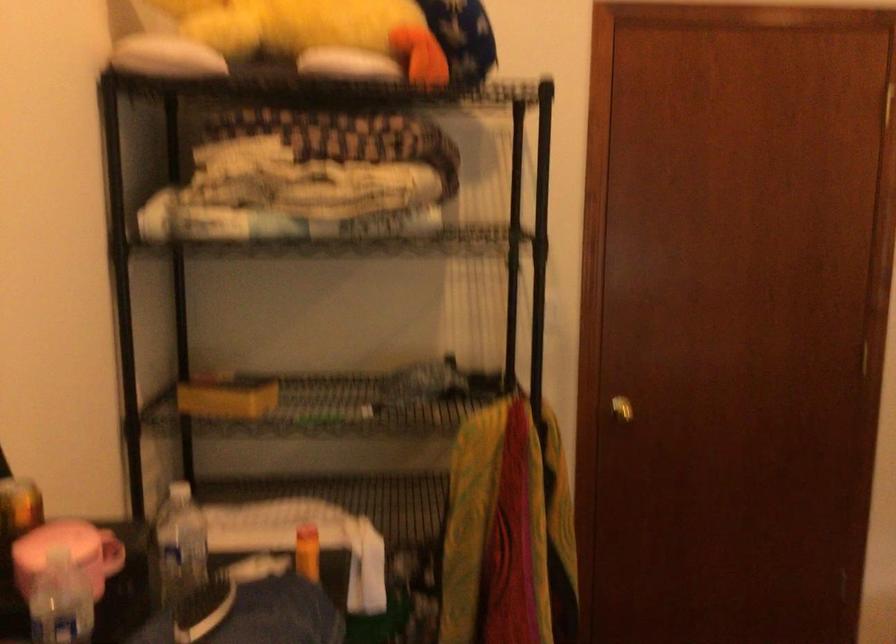
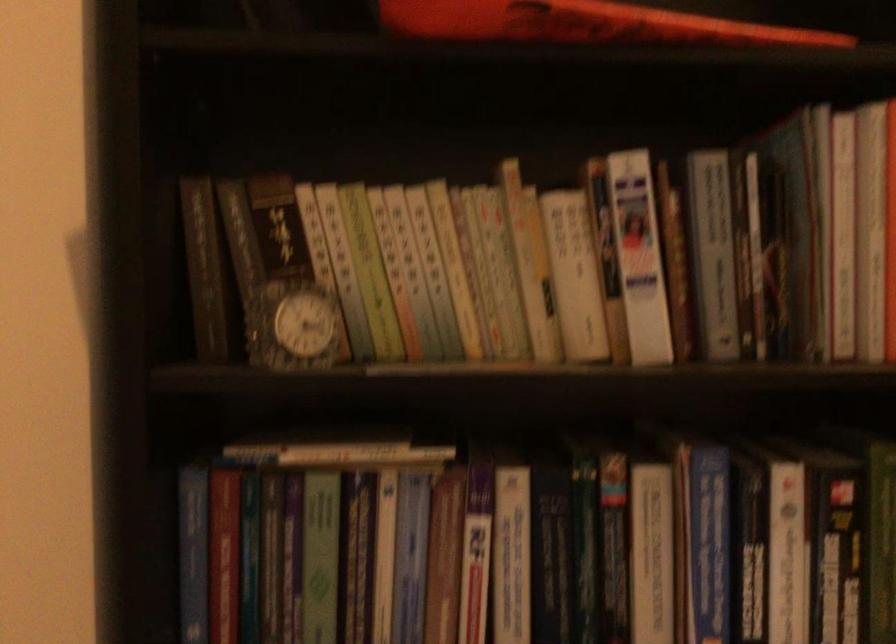
Question: How did the camera likely rotate?

Choices:
 (A) Left
 (B) Right
 (C) Up
 (D) Down

Answer: (A)